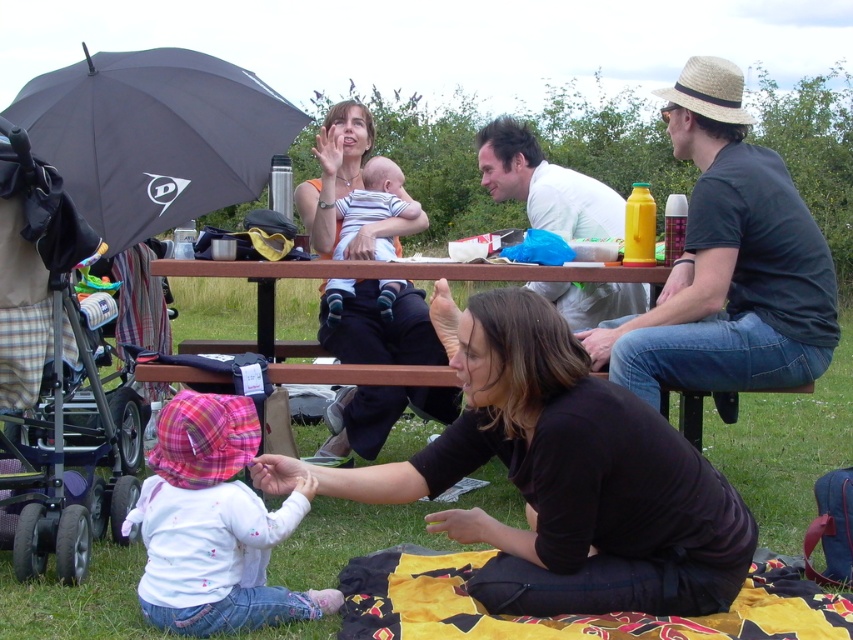
You are standing at the picnic area and want to take a photo of the point at coordinates (766, 336). Since the camera you have can only focus on objects within 3 meters, will the point be in focus?

The point at coordinates (766, 336) is 3.32 meters away from the viewer, which is beyond the camera focus range of 3 meters. Therefore, the point will not be in focus.